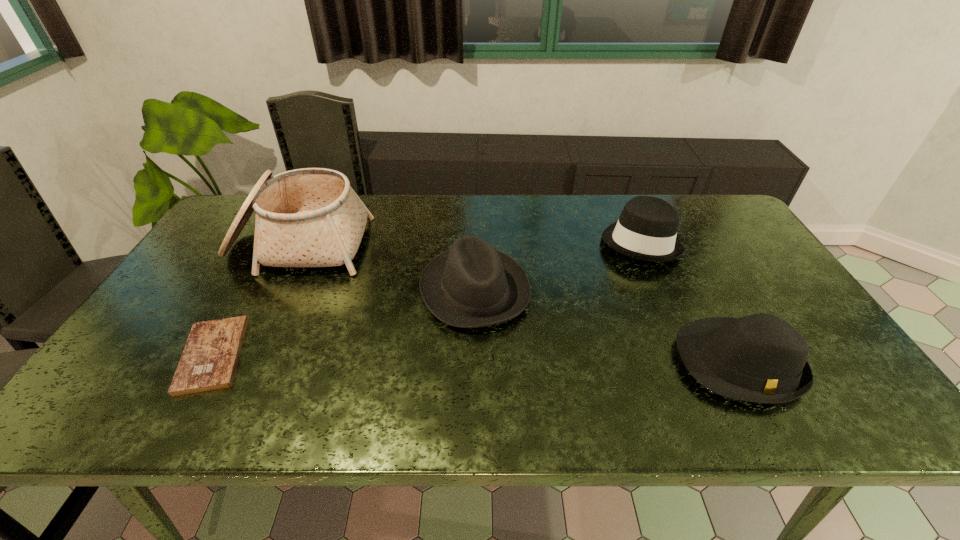
Locate an element on the screen. basket is located at coordinates (311, 217).

Where is `the third object from right to left`? This screenshot has height=540, width=960. the third object from right to left is located at coordinates (472, 285).

This screenshot has width=960, height=540. I want to click on Bible, so click(x=209, y=360).

This screenshot has height=540, width=960. I want to click on free point located with the lid open on the basket, so click(x=263, y=316).

Find the location of `free space located on the left of the third object from right to left`. free space located on the left of the third object from right to left is located at coordinates (302, 289).

What are the coordinates of `free location located on the right of the shortest object` in the screenshot? It's located at (307, 354).

At what (x,y) coordinates should I click in order to perform the action: click on basket positioned at the far edge. Please return your answer as a coordinate pair (x, y). The image size is (960, 540). Looking at the image, I should click on (311, 217).

The height and width of the screenshot is (540, 960). What are the coordinates of `fedora situated at the far edge` in the screenshot? It's located at (646, 230).

The height and width of the screenshot is (540, 960). In order to click on fedora that is at the near edge in this screenshot , I will do `click(761, 358)`.

Locate an element on the screen. This screenshot has height=540, width=960. Bible present at the near edge is located at coordinates (209, 360).